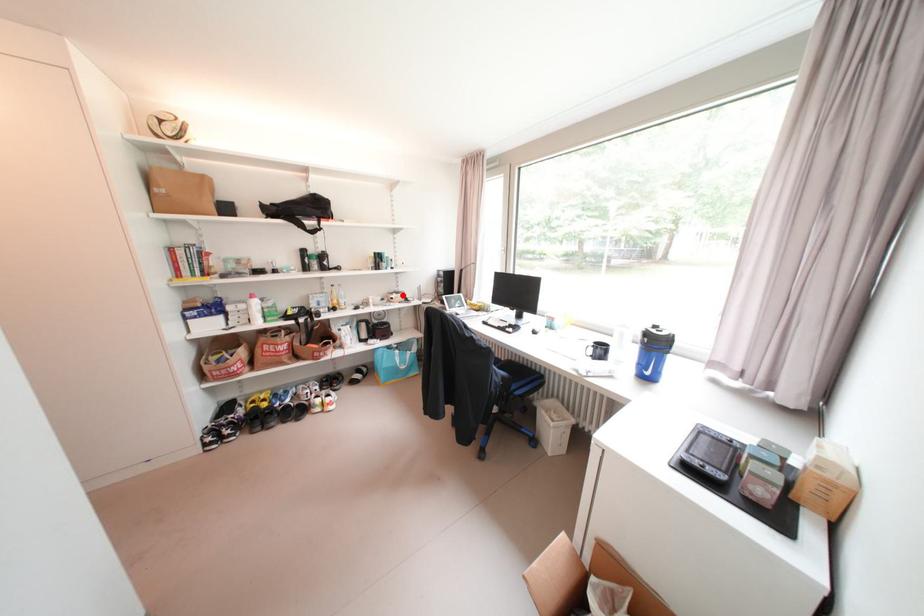
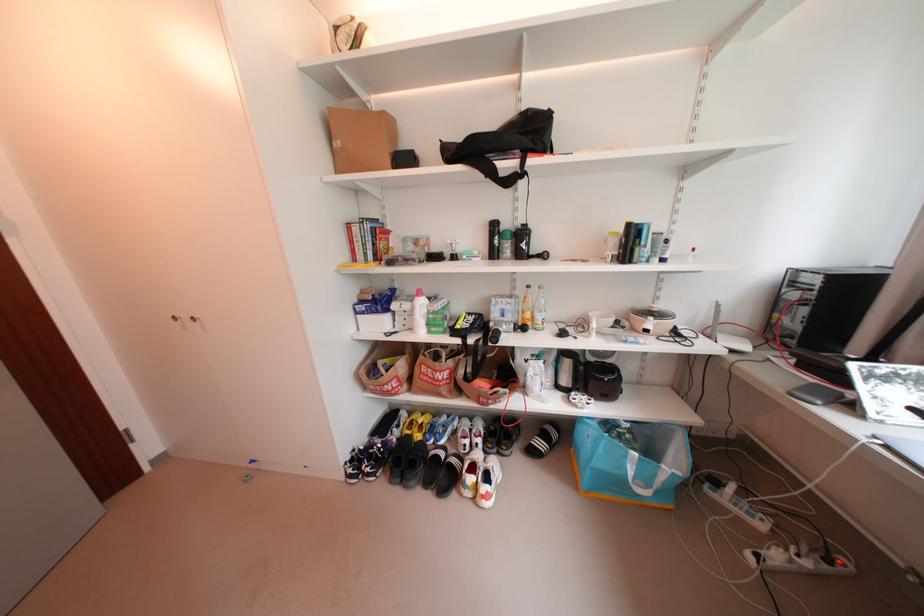
The point at the highlighted location is marked in the first image. Where is the corresponding point in the second image?

(660, 320)